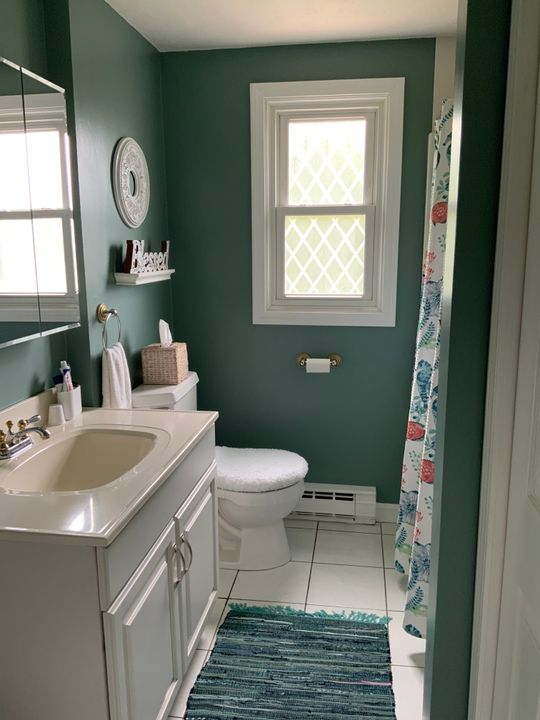
The width and height of the screenshot is (540, 720). Find the location of `1 sink`. 1 sink is located at coordinates (94, 459).